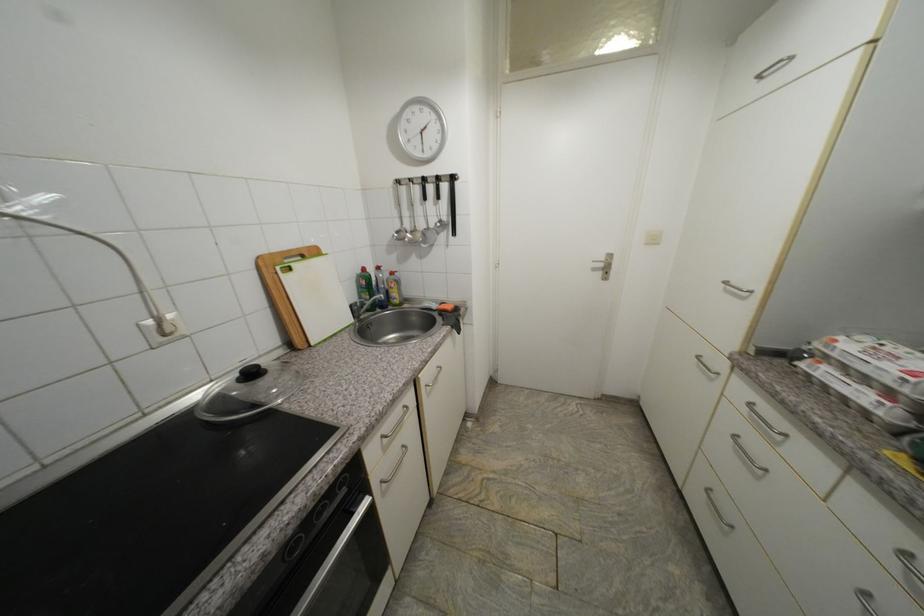
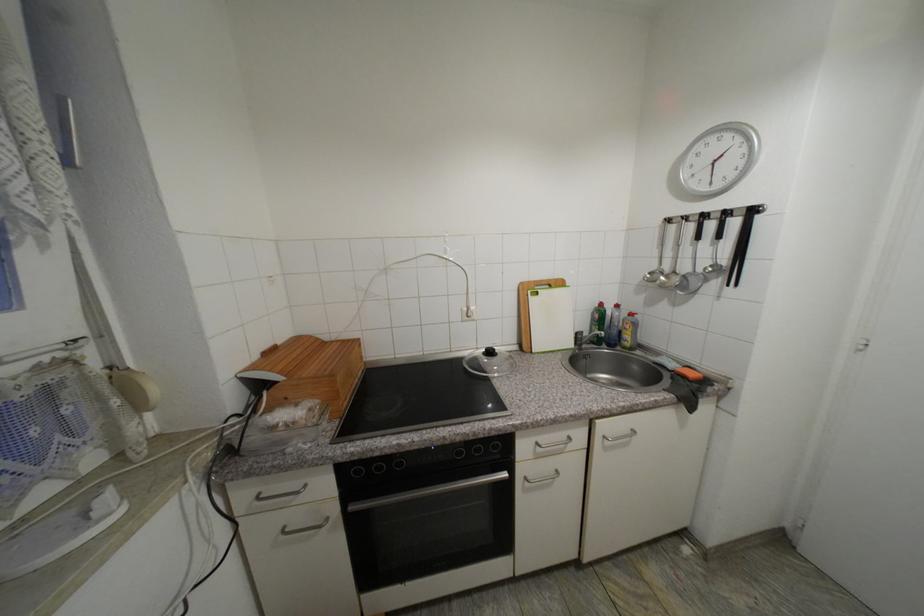
Question: Based on the continuous images, in which direction is the camera rotating? Reply with the corresponding letter.

Choices:
 (A) Left
 (B) Right
 (C) Up
 (D) Down

Answer: (A)